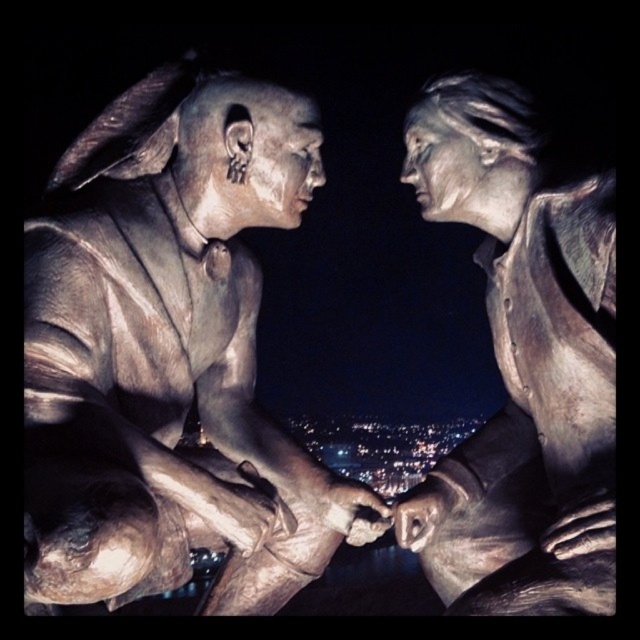
Which of these two, bronze statue at left or bronze statue at center, stands shorter?

bronze statue at center

Is bronze statue at left to the right of bronze statue at center from the viewer's perspective?

In fact, bronze statue at left is to the left of bronze statue at center.

Is point (164, 241) closer to viewer compared to point (612, 496)?

No, (164, 241) is further to viewer.

Identify the location of bronze statue at left. Image resolution: width=640 pixels, height=640 pixels. click(170, 355).